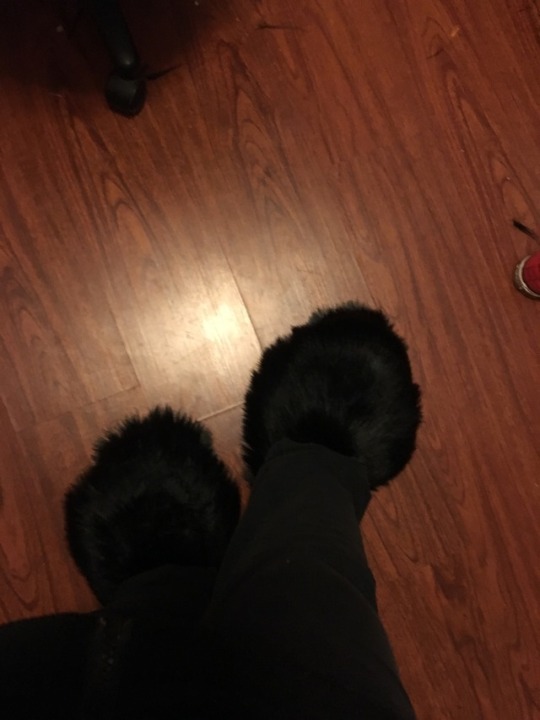
Image resolution: width=540 pixels, height=720 pixels. I want to click on wood floor, brown, so click(206, 324).